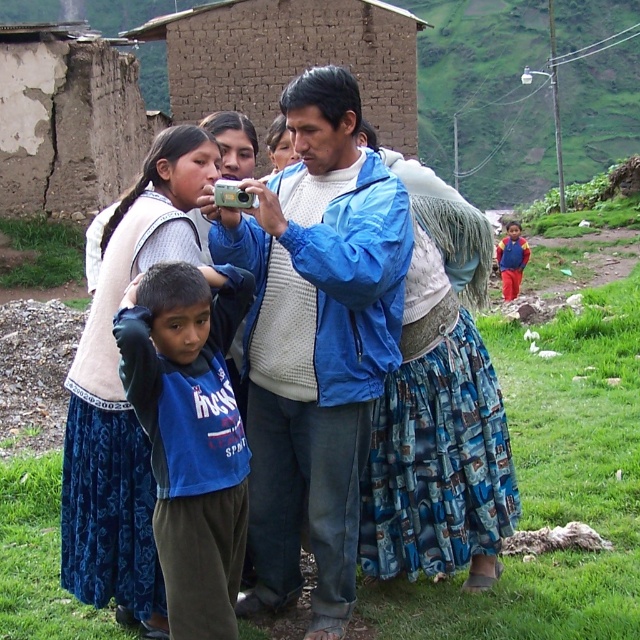
Is blue fabric shirt at center above blue matte jacket at center?

No, blue fabric shirt at center is not above blue matte jacket at center.

Between blue fabric shirt at center and blue matte jacket at center, which one has more height?

Standing taller between the two is blue matte jacket at center.

Is point (406, 356) farther from camera compared to point (310, 177)?

No.

Where is `blue fabric shirt at center`? This screenshot has width=640, height=640. blue fabric shirt at center is located at coordinates (364, 371).

Between blue cotton shirt at center and white knit sweater at center, which one is positioned lower?

white knit sweater at center is below.

Is point (198, 518) positioned in front of point (184, 236)?

Yes, point (198, 518) is closer to viewer.

Is point (189, 305) more distant than point (112, 356)?

That is False.

Locate an element on the screen. The height and width of the screenshot is (640, 640). blue cotton shirt at center is located at coordinates (189, 433).

Is point (294, 358) positioned in front of point (136, 352)?

No, it is behind (136, 352).

In the scene shown: Is blue matte jacket at center shorter than blue cotton shirt at center?

No, blue matte jacket at center is not shorter than blue cotton shirt at center.

Is point (348, 308) more distant than point (236, 323)?

Yes, it is behind point (236, 323).

At what (x,y) coordinates should I click in order to perform the action: click on blue matte jacket at center. Please return your answer as a coordinate pair (x, y). The image size is (640, 640). Looking at the image, I should click on (316, 340).